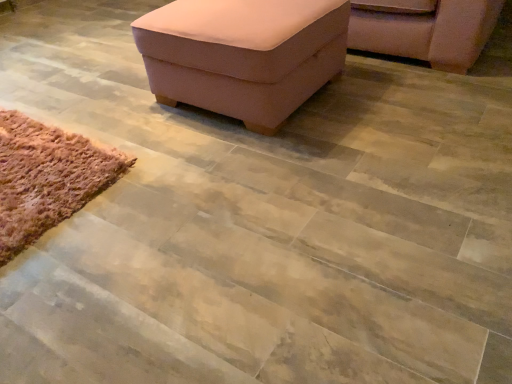
The image size is (512, 384). What do you see at coordinates (243, 54) in the screenshot?
I see `pink fabric ottoman at upper center` at bounding box center [243, 54].

Where is `pink fabric ottoman at upper center`? pink fabric ottoman at upper center is located at coordinates (243, 54).

Identify the location of chair above the pink fabric ottoman at upper center (from the image's perspective). Image resolution: width=512 pixels, height=384 pixels. (429, 33).

Do you think pink fabric chair at upper right is within pink fabric ottoman at upper center, or outside of it?

pink fabric chair at upper right is not enclosed by pink fabric ottoman at upper center.

From a real-world perspective, is pink fabric chair at upper right below pink fabric ottoman at upper center?

Yes, from a real-world perspective, pink fabric chair at upper right is beneath pink fabric ottoman at upper center.

Does point (456, 2) come closer to viewer compared to point (289, 105)?

No, (456, 2) is further to viewer.

Could you tell me if pink fabric ottoman at upper center is facing brown fuzzy rug at lower left?

Yes, pink fabric ottoman at upper center is facing brown fuzzy rug at lower left.

Is pink fabric ottoman at upper center positioned behind brown fuzzy rug at lower left?

Yes, pink fabric ottoman at upper center is behind brown fuzzy rug at lower left.

From the picture: Which object is positioned more to the right, pink fabric ottoman at upper center or brown fuzzy rug at lower left?

pink fabric ottoman at upper center is more to the right.

From their relative heights in the image, would you say brown fuzzy rug at lower left is taller or shorter than pink fabric chair at upper right?

In the image, brown fuzzy rug at lower left appears to be shorter than pink fabric chair at upper right.

Is brown fuzzy rug at lower left placed right next to pink fabric chair at upper right?

There is a gap between brown fuzzy rug at lower left and pink fabric chair at upper right.

Considering the relative sizes of brown fuzzy rug at lower left and pink fabric chair at upper right in the image provided, is brown fuzzy rug at lower left smaller than pink fabric chair at upper right?

Yes.

Considering the positions of point (46, 158) and point (426, 49), is point (46, 158) closer or farther from the camera than point (426, 49)?

Point (46, 158) is closer to the camera than point (426, 49).

From a real-world perspective, which object rests below the other?

From a 3D spatial view, pink fabric chair at upper right is below.

In the image, there is a pink fabric ottoman at upper center. At what (x,y) coordinates should I click in order to perform the action: click on chair above it (from the image's perspective). Please return your answer as a coordinate pair (x, y). The image size is (512, 384). Looking at the image, I should click on (429, 33).

Does pink fabric ottoman at upper center lie behind pink fabric chair at upper right?

No, it is not.

From the image's perspective, is pink fabric ottoman at upper center located above pink fabric chair at upper right?

No.

Could you tell me if brown fuzzy rug at lower left is facing pink fabric ottoman at upper center?

No, brown fuzzy rug at lower left does not turn towards pink fabric ottoman at upper center.

Is brown fuzzy rug at lower left directly adjacent to pink fabric ottoman at upper center?

No, brown fuzzy rug at lower left is not making contact with pink fabric ottoman at upper center.

From the image's perspective, is brown fuzzy rug at lower left on pink fabric ottoman at upper center?

No, from the image's perspective, brown fuzzy rug at lower left is not on top of pink fabric ottoman at upper center.

Would you say brown fuzzy rug at lower left is inside or outside pink fabric ottoman at upper center?

brown fuzzy rug at lower left is spatially situated outside pink fabric ottoman at upper center.

From the image's perspective, which object appears higher, pink fabric chair at upper right or brown fuzzy rug at lower left?

pink fabric chair at upper right.

Considering the positions of objects pink fabric chair at upper right and brown fuzzy rug at lower left in the image provided, who is more to the right, pink fabric chair at upper right or brown fuzzy rug at lower left?

pink fabric chair at upper right is more to the right.

Considering the relative sizes of pink fabric chair at upper right and brown fuzzy rug at lower left in the image provided, is pink fabric chair at upper right taller than brown fuzzy rug at lower left?

Yes.

At what (x,y) coordinates should I click in order to perform the action: click on chair that appears behind the pink fabric ottoman at upper center. Please return your answer as a coordinate pair (x, y). Looking at the image, I should click on (429, 33).

This screenshot has height=384, width=512. I want to click on mat that is under the pink fabric ottoman at upper center (from a real-world perspective), so click(47, 178).

Based on their spatial positions, is pink fabric chair at upper right or brown fuzzy rug at lower left closer to pink fabric ottoman at upper center?

brown fuzzy rug at lower left is closer to pink fabric ottoman at upper center.

Estimate the real-world distances between objects in this image. Which object is further from brown fuzzy rug at lower left, pink fabric ottoman at upper center or pink fabric chair at upper right?

pink fabric chair at upper right lies further to brown fuzzy rug at lower left than the other object.

Looking at the image, which one is located closer to brown fuzzy rug at lower left, pink fabric chair at upper right or pink fabric ottoman at upper center?

pink fabric ottoman at upper center is closer to brown fuzzy rug at lower left.

Looking at this image, based on their spatial positions, is pink fabric ottoman at upper center or brown fuzzy rug at lower left further from pink fabric chair at upper right?

brown fuzzy rug at lower left.

When comparing their distances from pink fabric chair at upper right, does brown fuzzy rug at lower left or pink fabric ottoman at upper center seem closer?

Based on the image, pink fabric ottoman at upper center appears to be nearer to pink fabric chair at upper right.

Looking at the image, which one is located further to pink fabric ottoman at upper center, brown fuzzy rug at lower left or pink fabric chair at upper right?

pink fabric chair at upper right.

Locate an element on the screen. furniture situated between brown fuzzy rug at lower left and pink fabric chair at upper right from left to right is located at coordinates (243, 54).